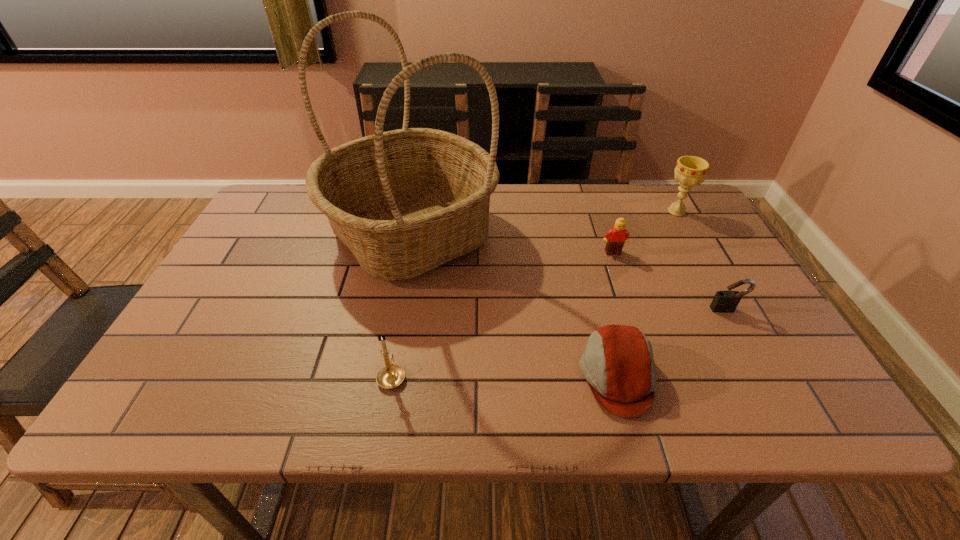
Point out which object is positioned as the fourth nearest to the cap. Please provide its 2D coordinates. Your answer should be formatted as a tuple, i.e. [(x, y)], where the tuple contains the x and y coordinates of a point satisfying the conditions above.

[(390, 376)]

Image resolution: width=960 pixels, height=540 pixels. I want to click on vacant point that satisfies the following two spatial constraints: 1. with the keyhole on the front of the padlock; 2. on the front-facing side of the cap, so click(764, 376).

The height and width of the screenshot is (540, 960). I want to click on free point that satisfies the following two spatial constraints: 1. on the handle side of the fifth shortest object; 2. on the right side of the candle holder, so click(420, 212).

Locate an element on the screen. free space that satisfies the following two spatial constraints: 1. on the handle side of the candle holder; 2. on the left side of the chalice is located at coordinates (420, 212).

Locate an element on the screen. The width and height of the screenshot is (960, 540). vacant space that satisfies the following two spatial constraints: 1. with the keyhole on the front of the third nearest object; 2. on the front-facing side of the cap is located at coordinates (764, 376).